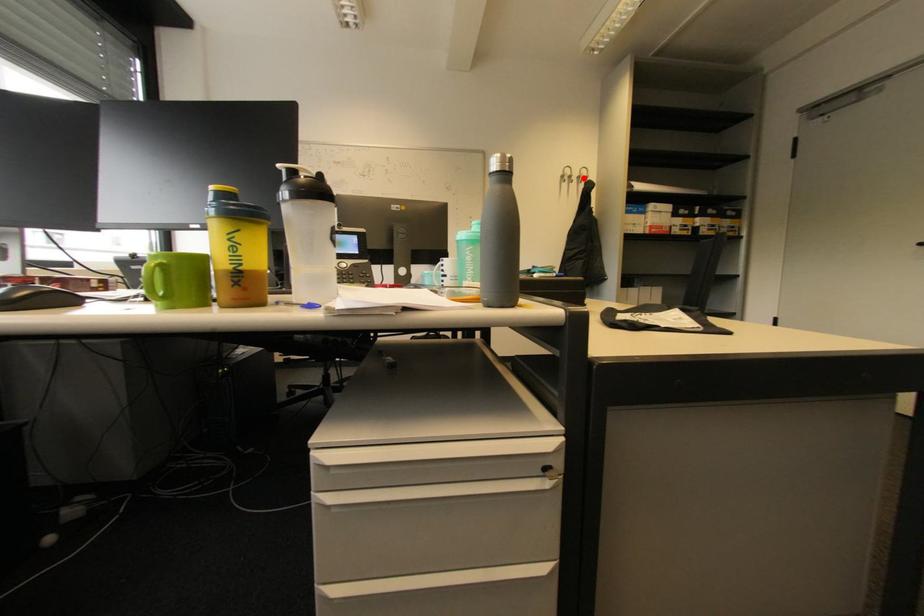
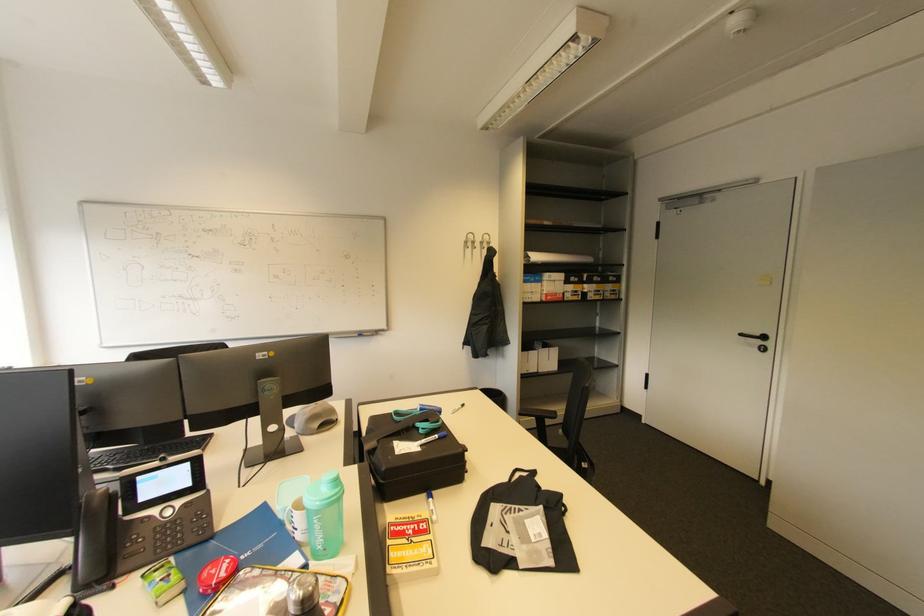
Where in the second image is the point corresponding to the highlighted location from the first image?

(487, 244)